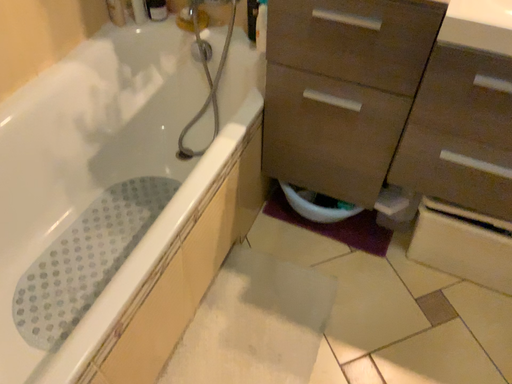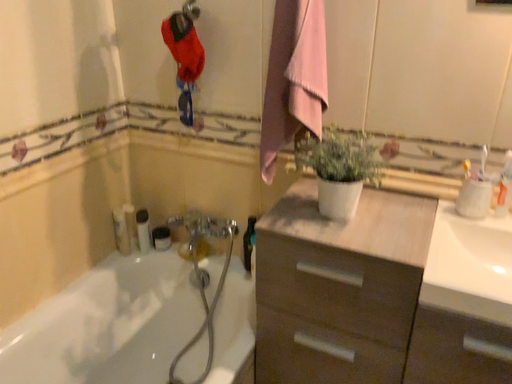
Question: Which way did the camera rotate in the video?

Choices:
 (A) rotated downward
 (B) rotated upward

Answer: (B)